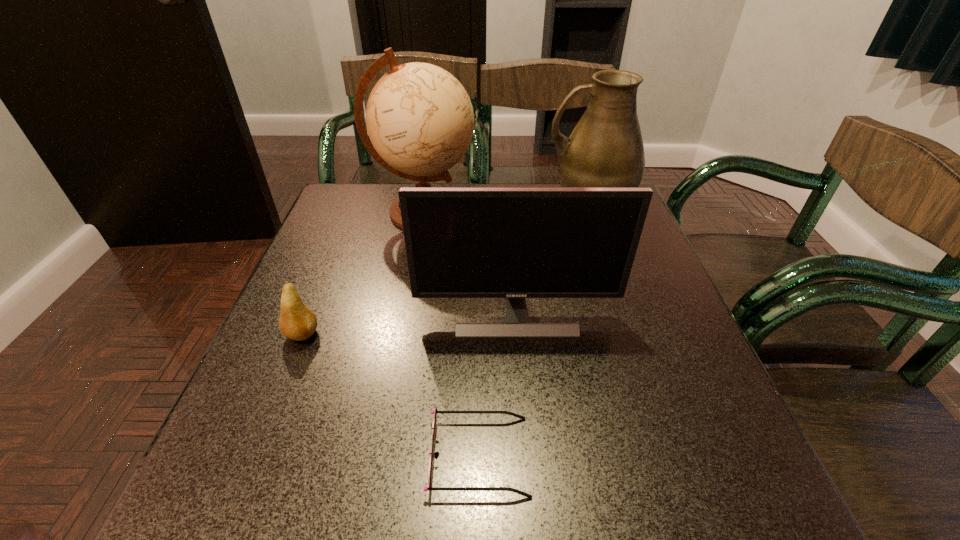
Identify the location of the tallest object. (420, 120).

Image resolution: width=960 pixels, height=540 pixels. Identify the location of pitcher. point(605,149).

Find the location of a particular element. Image resolution: width=960 pixels, height=540 pixels. the third tallest object is located at coordinates (514, 243).

Identify the location of the leftmost object. (297, 322).

The height and width of the screenshot is (540, 960). Find the location of `the fourth tallest object`. the fourth tallest object is located at coordinates (297, 322).

Locate an element on the screen. The width and height of the screenshot is (960, 540). the shortest object is located at coordinates (435, 412).

Locate an element on the screen. This screenshot has height=540, width=960. the nearest object is located at coordinates pos(435,412).

Identify the location of free space located 0.230m on the surface of the globe. Image resolution: width=960 pixels, height=540 pixels. (562, 212).

Locate an element on the screen. This screenshot has width=960, height=540. vacant space located on the handle side of the pitcher is located at coordinates (422, 206).

Find the location of a particular element. This screenshot has height=540, width=960. vacant space located 0.320m on the handle side of the pitcher is located at coordinates (426, 206).